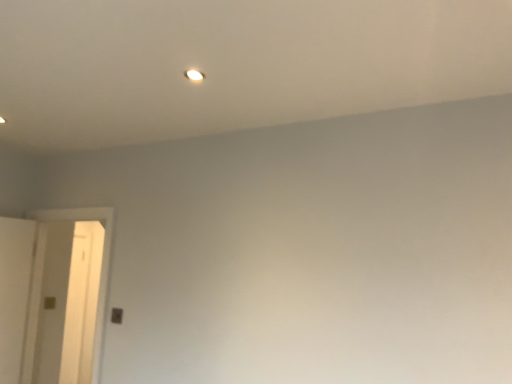
Question: From the image's perspective, relative to white glossy light at upper center, is white matte door at left above or below?

Choices:
 (A) below
 (B) above

Answer: (A)

Question: Considering the positions of white matte door at left and white glossy light at upper center in the image, is white matte door at left bigger or smaller than white glossy light at upper center?

Choices:
 (A) big
 (B) small

Answer: (A)

Question: Does point (30, 375) appear closer or farther from the camera than point (186, 74)?

Choices:
 (A) closer
 (B) farther

Answer: (B)

Question: Considering the positions of point (194, 79) and point (109, 228), is point (194, 79) closer or farther from the camera than point (109, 228)?

Choices:
 (A) closer
 (B) farther

Answer: (A)

Question: Based on their positions, is white glossy light at upper center located to the left or right of white matte door at left?

Choices:
 (A) right
 (B) left

Answer: (A)

Question: In terms of size, does white glossy light at upper center appear bigger or smaller than white matte door at left?

Choices:
 (A) small
 (B) big

Answer: (A)

Question: From the image's perspective, relative to white matte door at left, is white glossy light at upper center above or below?

Choices:
 (A) below
 (B) above

Answer: (B)